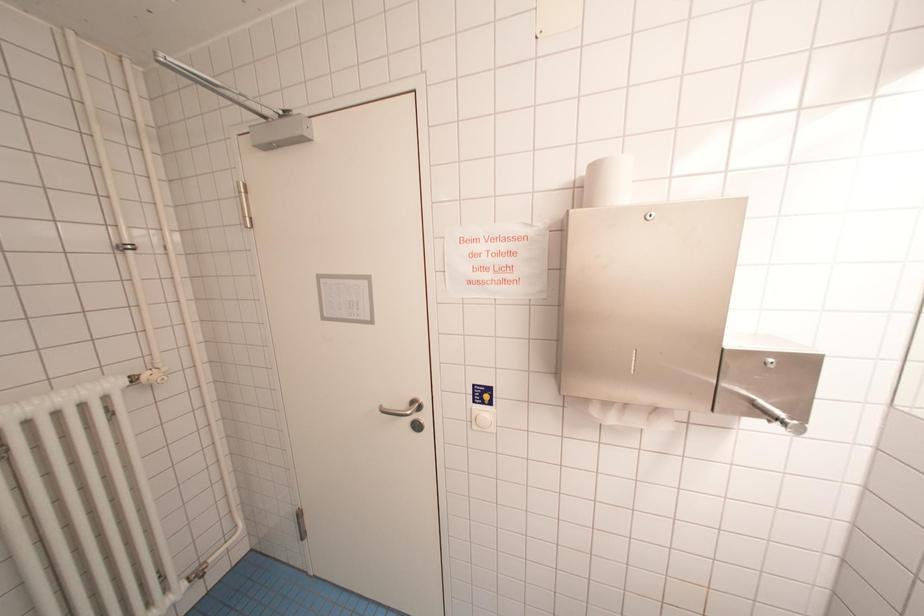
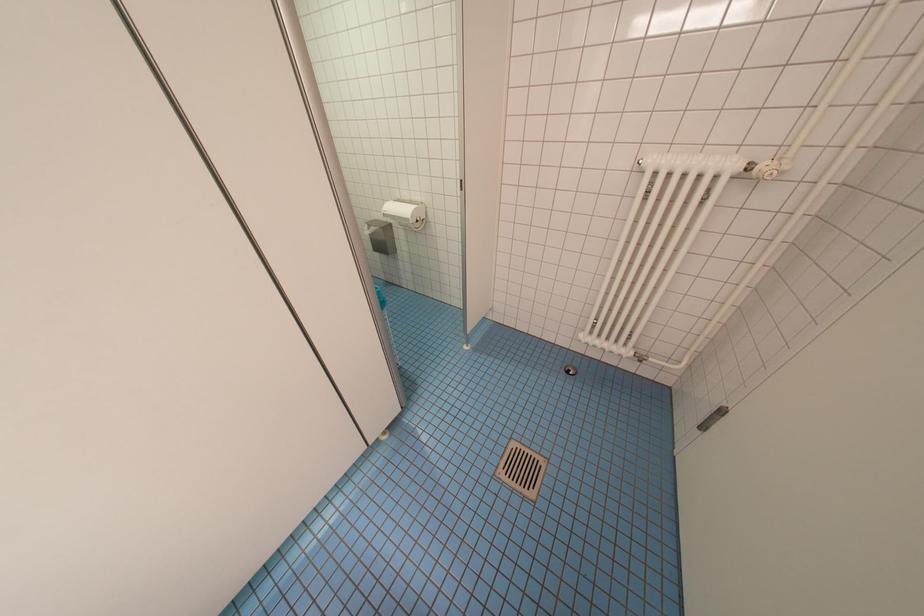
First-person continuous shooting, in which direction is the camera rotating?

The camera rotated toward left-down.